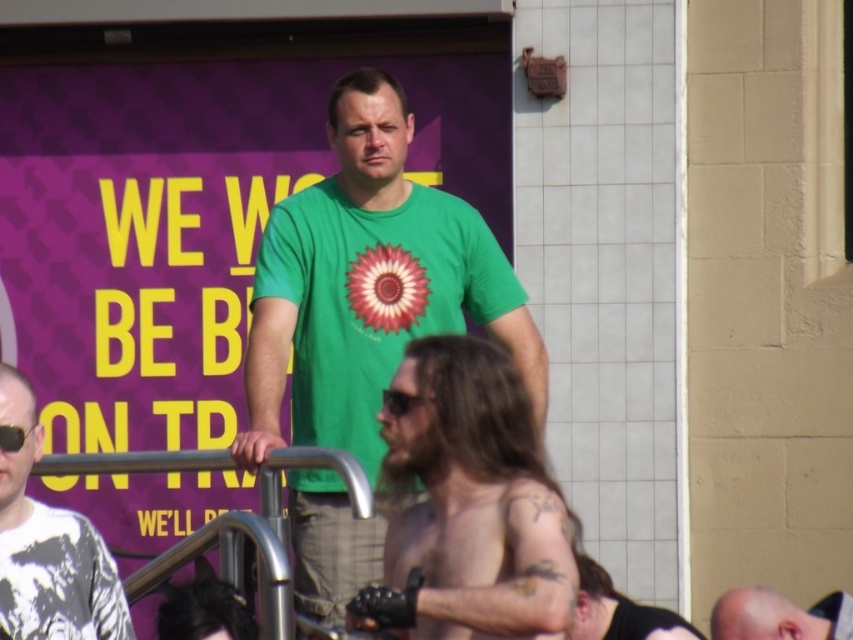
Between green matte t-shirt at center and bald head at center, which one has more height?

green matte t-shirt at center

Does green matte t-shirt at center have a greater width compared to bald head at center?

Incorrect, green matte t-shirt at center's width does not surpass bald head at center's.

Between point (457, 321) and point (741, 632), which one is positioned in front?

Point (741, 632) is in front.

You are a GUI agent. You are given a task and a screenshot of the screen. Output one action in this format:
    pyautogui.click(x=<x>, y=<y>)
    Task: Click on the green matte t-shirt at center
    Image resolution: width=853 pixels, height=640 pixels.
    Given the screenshot: What is the action you would take?
    pyautogui.click(x=368, y=284)

Is shiny leather glove at center smaller than shiny black leather glove at lower center?

Incorrect, shiny leather glove at center is not smaller in size than shiny black leather glove at lower center.

Who is more forward, (515, 504) or (585, 611)?

Point (515, 504) is more forward.

This screenshot has width=853, height=640. Identify the location of shiny leather glove at center. (468, 502).

Can you confirm if bald head at center is shorter than shiny black leather glove at lower center?

Correct, bald head at center is not as tall as shiny black leather glove at lower center.

Does point (735, 589) come behind point (579, 570)?

Yes, it is.

In the scene shown: Who is more forward, (712, 630) or (683, 628)?

Point (683, 628) is in front.

You are a GUI agent. You are given a task and a screenshot of the screen. Output one action in this format:
    pyautogui.click(x=<x>, y=<y>)
    Task: Click on the bald head at center
    
    Given the screenshot: What is the action you would take?
    pyautogui.click(x=779, y=616)